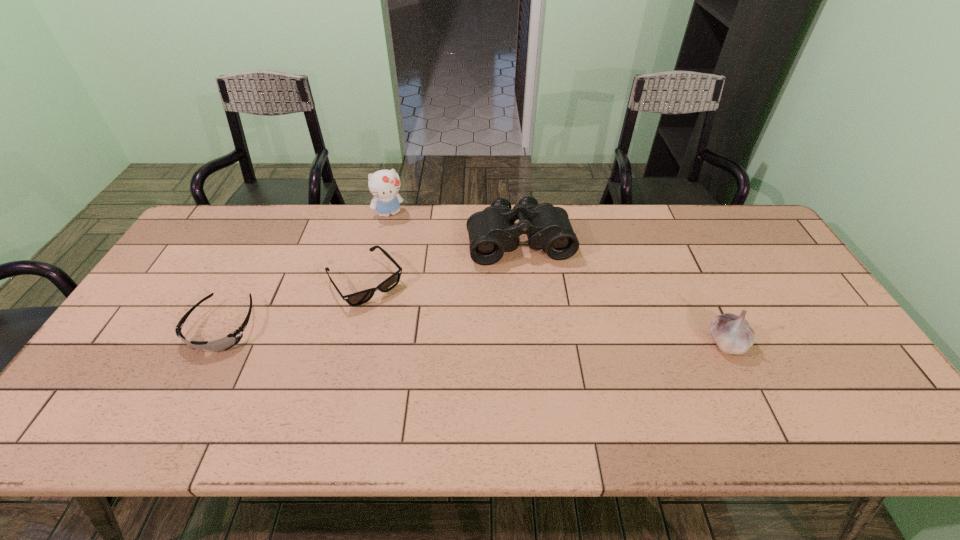
In order to click on object present at the left edge in this screenshot , I will do `click(230, 340)`.

Where is `vacant space at the far edge of the desktop`? vacant space at the far edge of the desktop is located at coordinates click(662, 221).

In the image, there is a desktop. Identify the location of vacant region at the near edge. (441, 393).

At what (x,y) coordinates should I click in order to perform the action: click on blank space at the left edge. Please return your answer as a coordinate pair (x, y). This screenshot has height=540, width=960. Looking at the image, I should click on (156, 297).

Identify the location of vacant region at the near left corner of the desktop. The width and height of the screenshot is (960, 540). (88, 387).

Identify the location of free space between the second object from right to left and the shorter sunglasses. (372, 285).

Image resolution: width=960 pixels, height=540 pixels. Find the location of `vacant space that's between the leftmost object and the garlic`. vacant space that's between the leftmost object and the garlic is located at coordinates (474, 335).

Image resolution: width=960 pixels, height=540 pixels. Find the location of `vacant area that lies between the leftmost object and the second shortest object`. vacant area that lies between the leftmost object and the second shortest object is located at coordinates (294, 305).

I want to click on free area in between the binoculars and the left sunglasses, so click(372, 285).

Identify the location of vacant area that lies between the kitten and the garlic. [558, 278].